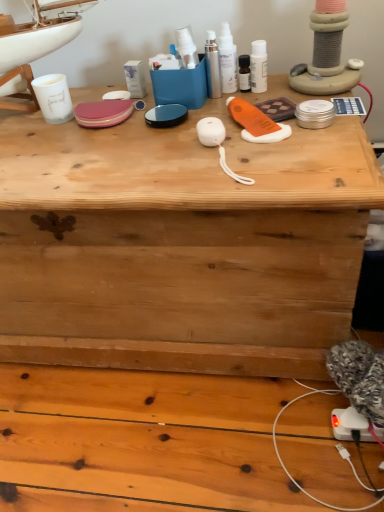
This screenshot has height=512, width=384. Find the location of `vacant space to the right of white glossy lotion at upper center, which is counted as the 3th toiletry, starting from the left`. vacant space to the right of white glossy lotion at upper center, which is counted as the 3th toiletry, starting from the left is located at coordinates (298, 91).